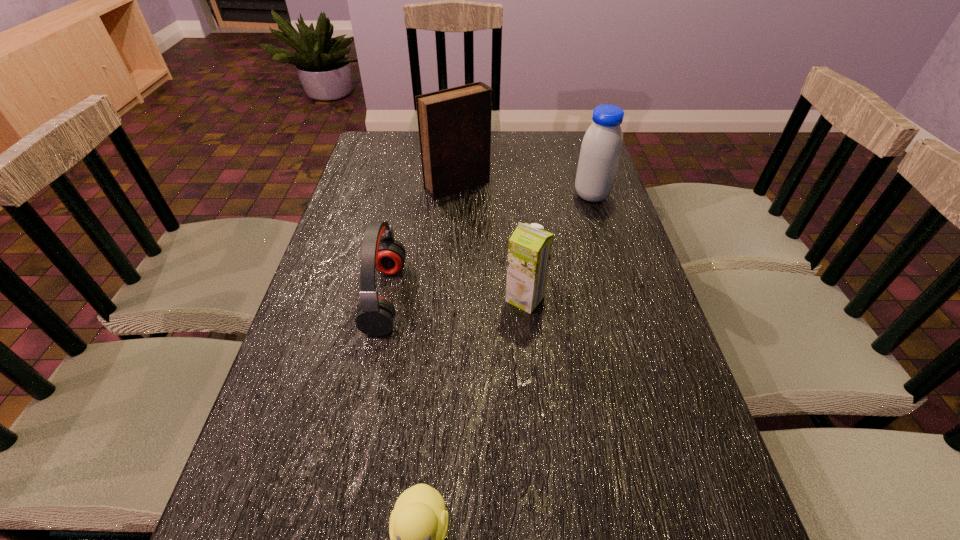
This screenshot has height=540, width=960. I want to click on object that is at the left edge, so click(x=375, y=317).

Where is `object present at the right edge`? object present at the right edge is located at coordinates (601, 148).

Image resolution: width=960 pixels, height=540 pixels. In the image, there is a desktop. In order to click on vacant area at the far edge in this screenshot , I will do `click(543, 160)`.

This screenshot has width=960, height=540. I want to click on vacant region at the left edge of the desktop, so click(345, 312).

Locate an element on the screen. The height and width of the screenshot is (540, 960). free space at the right edge of the desktop is located at coordinates (631, 367).

In the image, there is a desktop. At what (x,y) coordinates should I click in order to perform the action: click on vacant space at the far left corner. Please return your answer as a coordinate pair (x, y). The image size is (960, 540). Looking at the image, I should click on (386, 143).

This screenshot has width=960, height=540. I want to click on vacant area that lies between the right soya milk and the earphone, so click(x=489, y=246).

This screenshot has height=540, width=960. I want to click on free spot between the shorter soya milk and the Bible, so click(x=492, y=242).

Where is `free point between the earphone and the Bible`? free point between the earphone and the Bible is located at coordinates (421, 241).

You are a GUI agent. You are given a task and a screenshot of the screen. Output one action in this format:
    pyautogui.click(x=<x>, y=<y>)
    Task: Click on the vacant area between the second object from right to left and the rightmost object
    This screenshot has width=960, height=540.
    Given the screenshot: What is the action you would take?
    pyautogui.click(x=559, y=247)